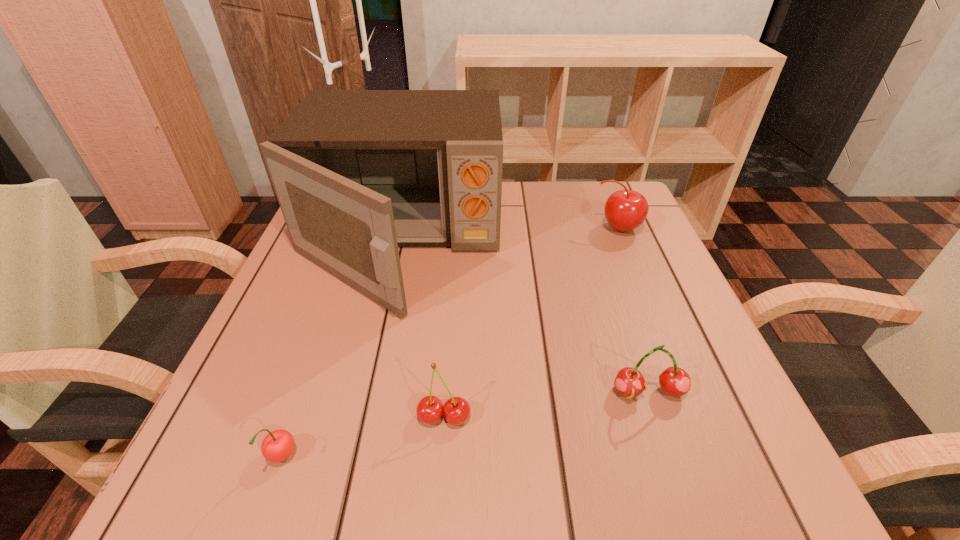
Choose which object is the nearest neighbor to the leftmost cherry. Please provide its 2D coordinates. Your answer should be formatted as a tuple, i.e. [(x, y)], where the tuple contains the x and y coordinates of a point satisfying the conditions above.

[(430, 409)]

Identify which cherry is the closest to the second cherry from left to right. Please provide its 2D coordinates. Your answer should be formatted as a tuple, i.e. [(x, y)], where the tuple contains the x and y coordinates of a point satisfying the conditions above.

[(277, 446)]

Find the location of a particular element. The height and width of the screenshot is (540, 960). cherry that is the nearest to the second cherry from left to right is located at coordinates (277, 446).